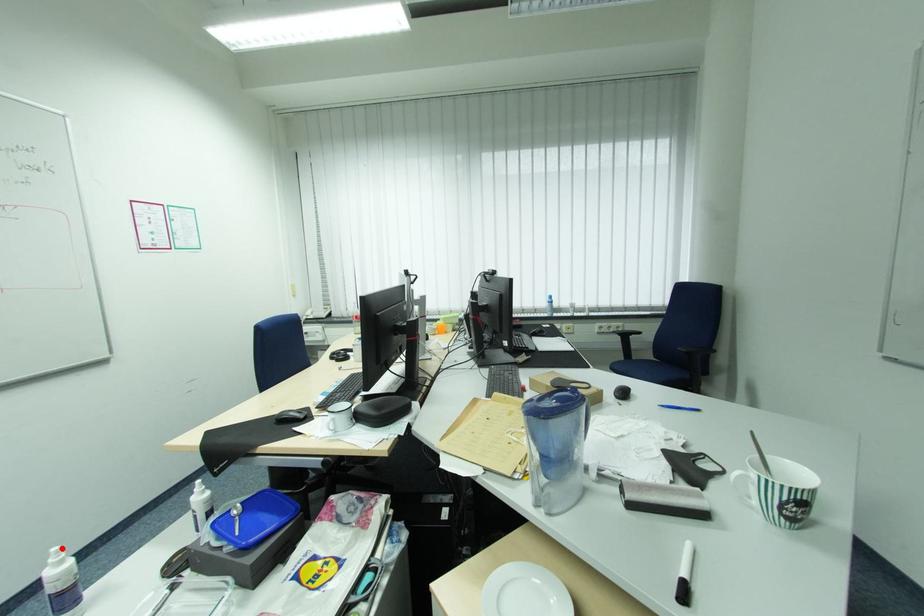
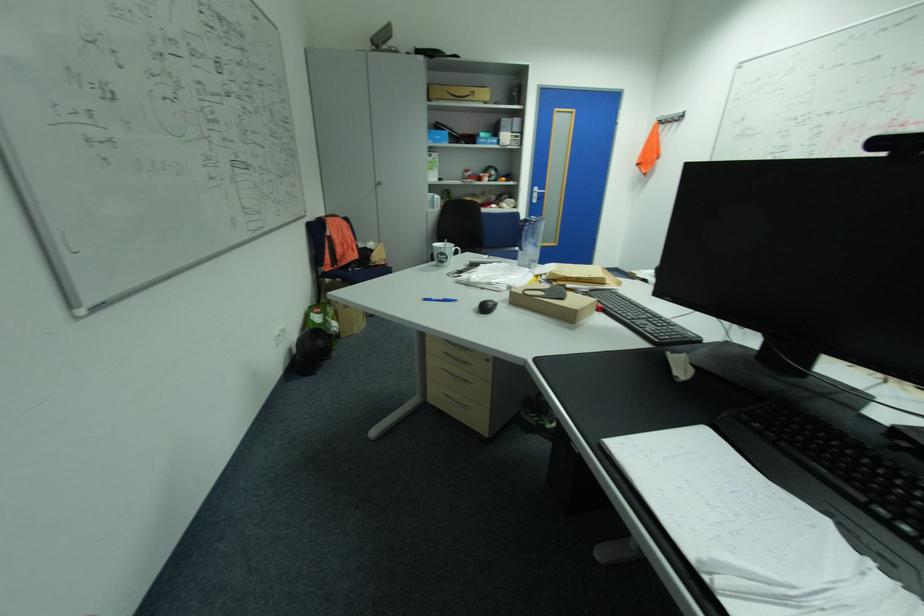
Question: I am providing you with two images of the same scene from different viewpoints. A red point is marked on the first image. Is the red point's position out of view in image 2?

Choices:
 (A) Yes
 (B) No

Answer: (A)